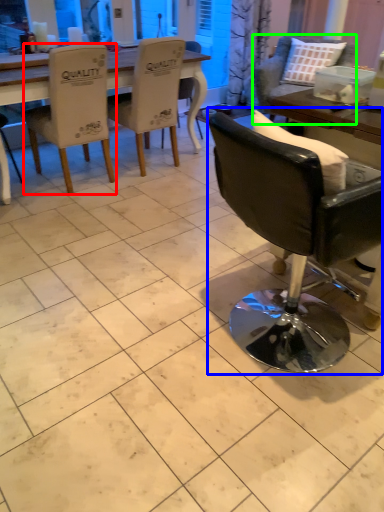
Question: Based on their relative distances, which object is farther from chair (highlighted by a red box)? Choose from chair (highlighted by a blue box) and chair (highlighted by a green box).

Choices:
 (A) chair
 (B) chair

Answer: (A)